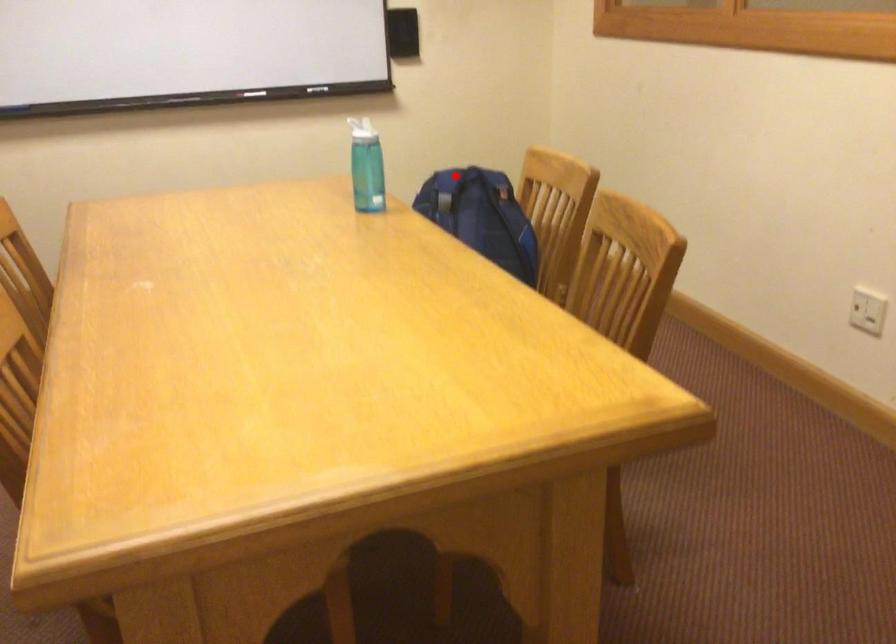
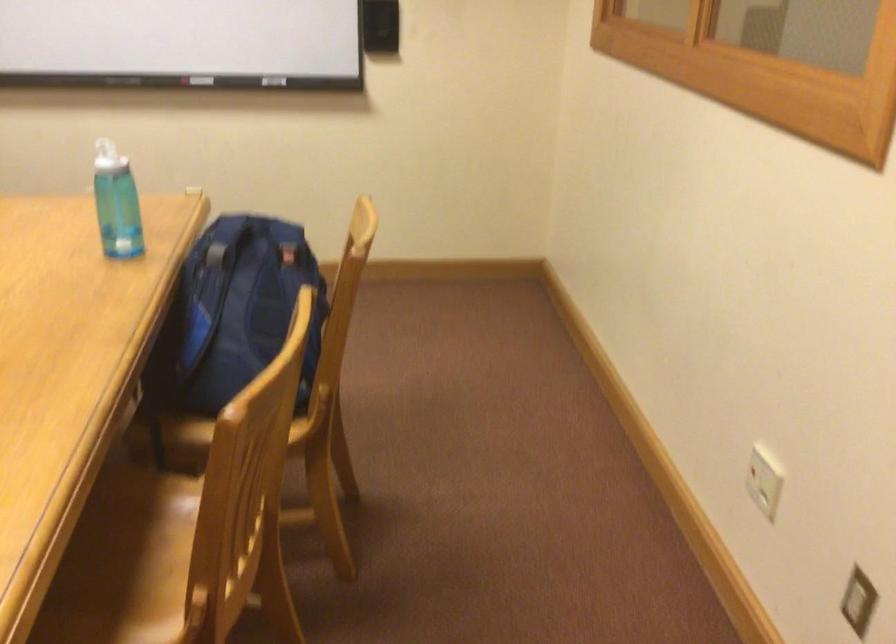
Question: I am providing you with two images of the same scene from different viewpoints. A red point is marked on the first image. Can you still see the location of the red point in image 2?

Choices:
 (A) Yes
 (B) No

Answer: (A)